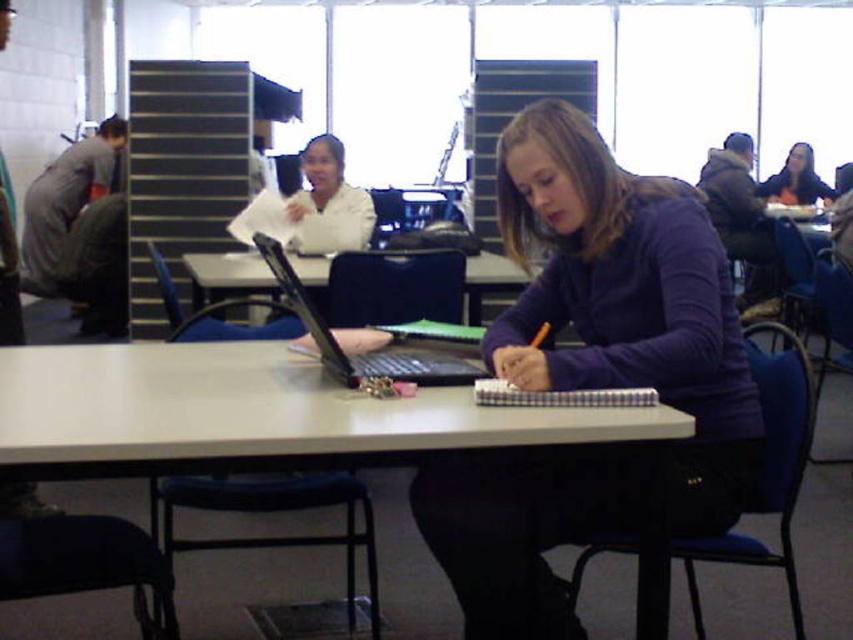
You are organizing a study session and need to place both the black plastic laptop at center and the checkered paper notebook at center on a small desk. Considering their sizes, which one should you place first to ensure they both fit comfortably?

The black plastic laptop at center is larger than the checkered paper notebook at center, so you should place the larger laptop first to ensure both items fit comfortably on the desk.

Looking at this image, you are a student who needs to place a 12 cm tall textbook on the table. Based on the scene, can the textbook fit between the black plastic laptop at center and the checkered paper notebook at center?

The black plastic laptop at center is much taller than the checkered paper notebook at center. Since the textbook is 12 cm tall, it might not fit between them if the space between the two objects is limited by their height difference. However, without knowing the exact distance between them, it is uncertain. Please check the available space.

You have a rectangular object that is 15 inches long. You want to place it on the white matte table at center. Considering the black plastic laptop at center is already on the table, can you determine if the object will fit on the table?

The white matte table at center might be wider than black plastic laptop at center, so there is a possibility that the 15 inches long object can fit on the table. However, the exact dimensions of the table aren not specified, so it is uncertain.